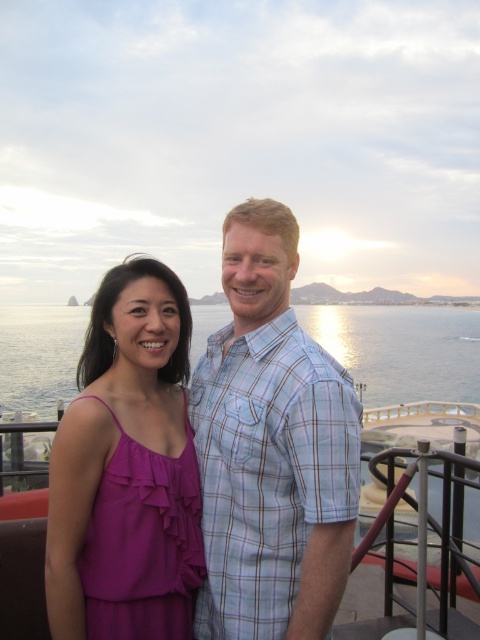
Question: Can you confirm if purple chiffon dress at center is wider than blue water at center?

Choices:
 (A) yes
 (B) no

Answer: (B)

Question: Is light blue plaid shirt at center thinner than blue water at center?

Choices:
 (A) yes
 (B) no

Answer: (A)

Question: Estimate the real-world distances between objects in this image. Which object is closer to the light blue plaid shirt at center?

Choices:
 (A) blue water at center
 (B) purple chiffon dress at center

Answer: (B)

Question: Among these points, which one is farthest from the camera?

Choices:
 (A) (132, 314)
 (B) (288, 268)
 (C) (382, 401)

Answer: (C)

Question: From the image, what is the correct spatial relationship of light blue plaid shirt at center in relation to blue water at center?

Choices:
 (A) left
 (B) right

Answer: (B)

Question: Among these objects, which one is farthest from the camera?

Choices:
 (A) light blue plaid shirt at center
 (B) blue water at center

Answer: (B)